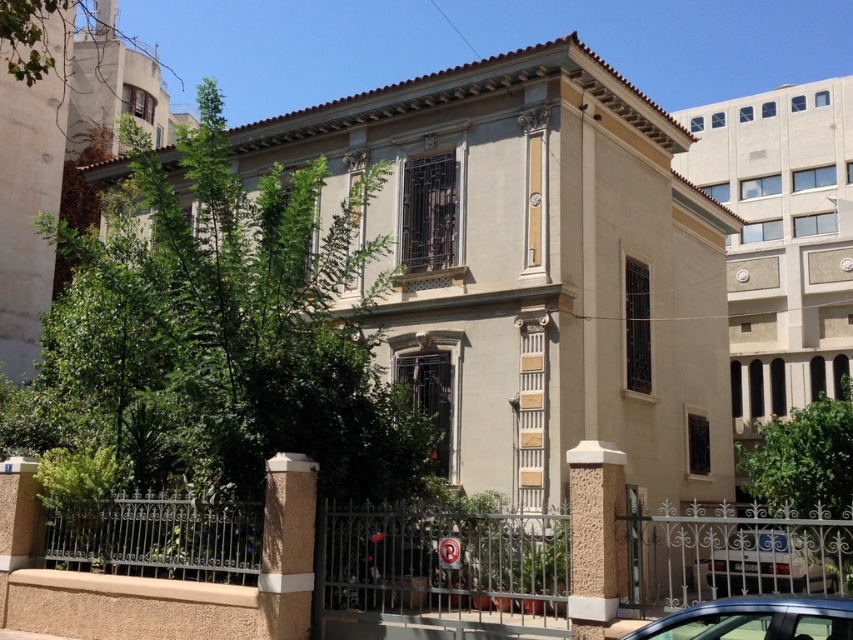
Question: Considering the relative positions of metallic blue car at lower right and white glossy car at lower right in the image provided, where is metallic blue car at lower right located with respect to white glossy car at lower right?

Choices:
 (A) above
 (B) below

Answer: (A)

Question: Can you confirm if metallic blue car at lower right is wider than white glossy car at lower right?

Choices:
 (A) no
 (B) yes

Answer: (A)

Question: Which point is closer to the camera taking this photo?

Choices:
 (A) (772, 576)
 (B) (816, 596)

Answer: (B)

Question: Among these points, which one is nearest to the camera?

Choices:
 (A) (782, 554)
 (B) (376, 520)

Answer: (B)

Question: Does black wrought iron fence at lower center have a larger size compared to metallic blue car at lower right?

Choices:
 (A) no
 (B) yes

Answer: (B)

Question: Which object is the farthest from the metallic blue car at lower right?

Choices:
 (A) black wrought iron fence at lower center
 (B) white glossy car at lower right

Answer: (A)